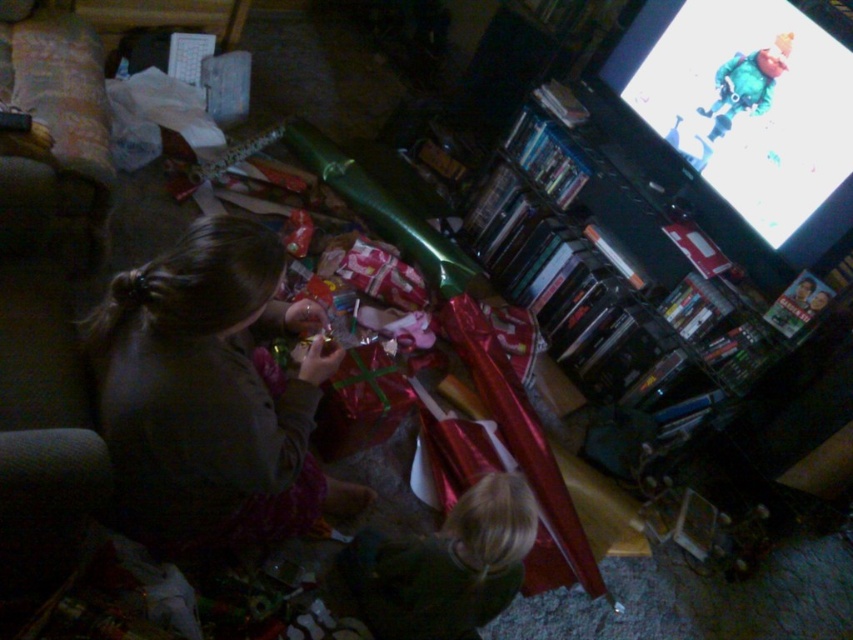
You are a guest in the living room and want to take a photo of the person with the dark gray sweater at center and the person with blonde hair at lower center. To ensure both are fully visible in the frame, should you adjust your camera angle upwards or downwards?

The dark gray sweater at center is above the blonde hair at lower center, so you should adjust your camera angle downwards to capture both in the frame.

In the cozy living room scene where two people are wrapping gifts, which object is positioned to the left of the other between the dark gray sweater at center and the blonde hair at lower center?

The dark gray sweater at center is positioned to the left of the blonde hair at lower center.